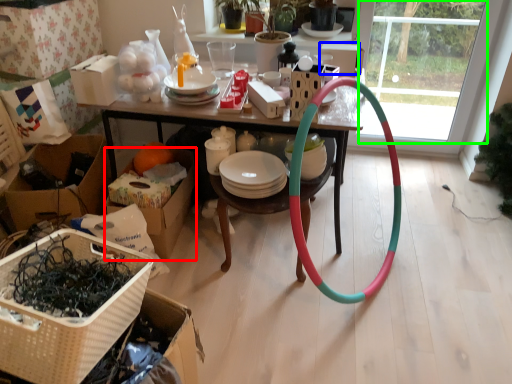
Question: Which object is the farthest from cardboard box (highlighted by a red box)? Choose among these: box (highlighted by a blue box) or glass door (highlighted by a green box).

Choices:
 (A) box
 (B) glass door

Answer: (B)